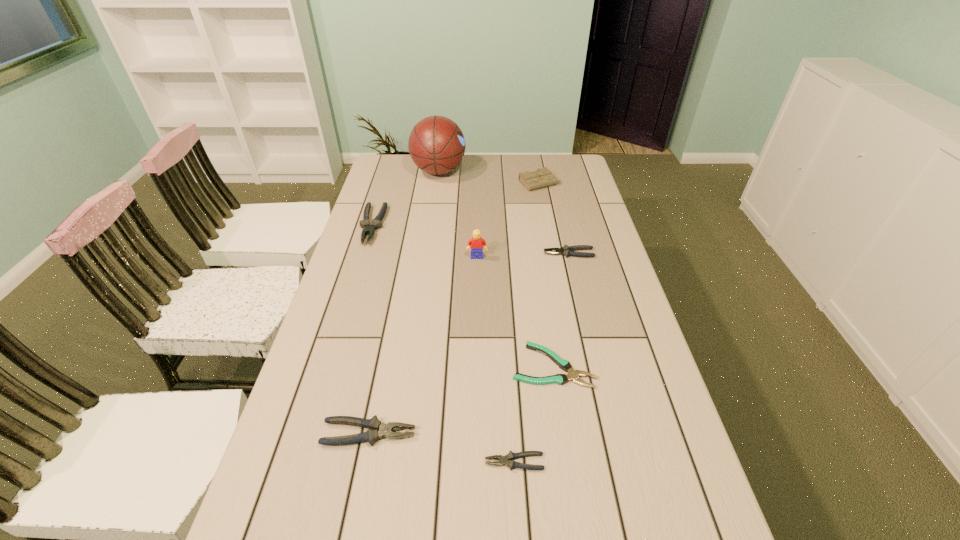
Locate an element on the screen. This screenshot has width=960, height=540. the fifth farthest pliers is located at coordinates (511, 456).

Identify the location of the second gray pliers from right to left. The height and width of the screenshot is (540, 960). (x=511, y=456).

Find the location of a particular element. the eighth tallest object is located at coordinates (573, 375).

What are the coordinates of `the fourth nearest object` in the screenshot? It's located at (573, 375).

The height and width of the screenshot is (540, 960). In order to click on vacant area located on the front of the tallest object in this screenshot , I will do `click(431, 224)`.

This screenshot has width=960, height=540. I want to click on vacant area situated on the face of the Lego, so 476,326.

Image resolution: width=960 pixels, height=540 pixels. I want to click on free space located on the front of the third tallest object, so click(546, 212).

Where is `vacant space located 0.180m at the gripping part of the tallest pliers`? Image resolution: width=960 pixels, height=540 pixels. vacant space located 0.180m at the gripping part of the tallest pliers is located at coordinates (354, 282).

Identify the location of blank space located 0.280m at the gripping part of the seventh farthest object. The image size is (960, 540). (539, 433).

At what (x,y) coordinates should I click in order to perform the action: click on free space located 0.220m at the gripping part of the sixth tallest object. Please return your answer as a coordinate pair (x, y). Looking at the image, I should click on (478, 253).